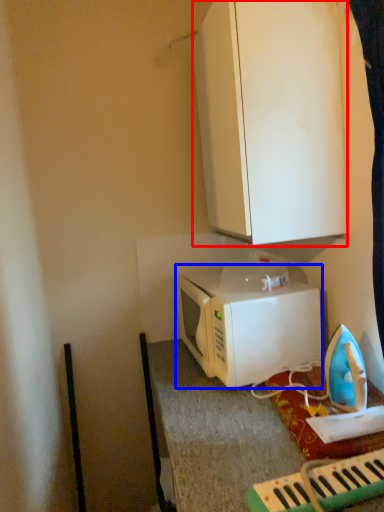
Question: Which object appears closest to the camera in this image, cabinetry (highlighted by a red box) or microwave oven (highlighted by a blue box)?

Choices:
 (A) cabinetry
 (B) microwave oven

Answer: (A)